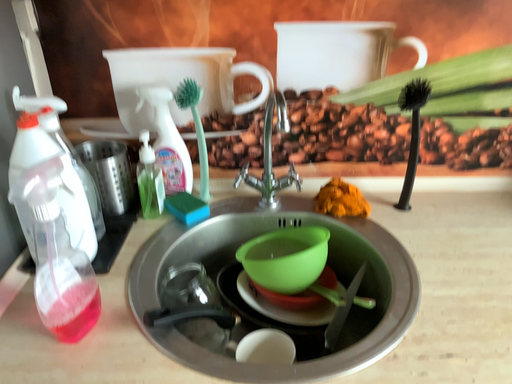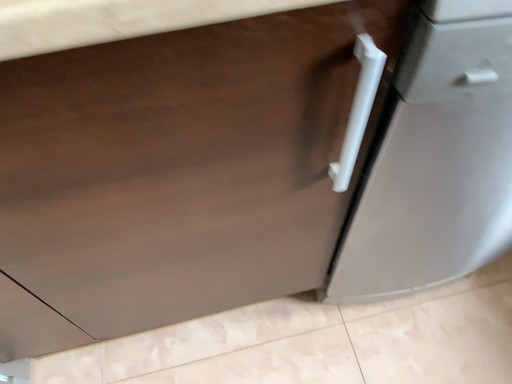
Question: Which way did the camera rotate in the video?

Choices:
 (A) rotated right
 (B) rotated left

Answer: (A)